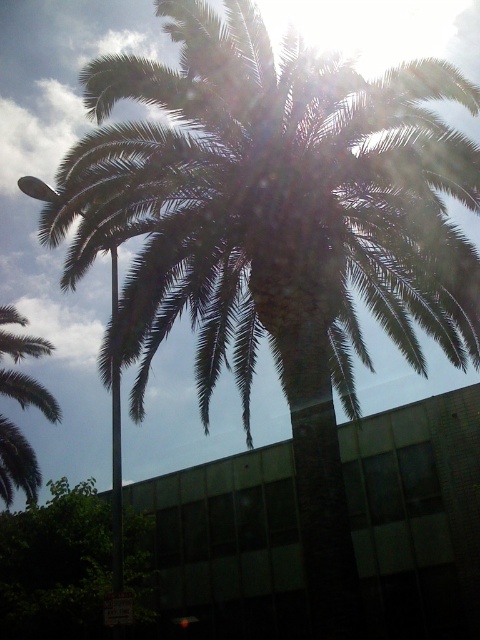
Question: Is green leafy tree at lower left wider than green leafy palm at upper left?

Choices:
 (A) no
 (B) yes

Answer: (A)

Question: Which of the following is the farthest from the observer?

Choices:
 (A) green leafy tree at lower left
 (B) green leafy palm at upper left

Answer: (B)

Question: Is green leafy tree at lower left positioned in front of green leafy palm at upper left?

Choices:
 (A) yes
 (B) no

Answer: (A)

Question: Is green leafy tree at lower left to the right of green leafy palm at upper left from the viewer's perspective?

Choices:
 (A) no
 (B) yes

Answer: (B)